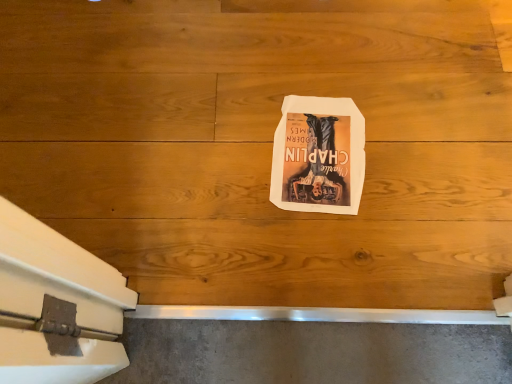
Describe the element at coordinates (318, 156) in the screenshot. This screenshot has width=512, height=384. I see `white paper at center` at that location.

This screenshot has width=512, height=384. What are the coordinates of `white paper at center` in the screenshot? It's located at (318, 156).

This screenshot has width=512, height=384. Find the location of `white paper at center`. white paper at center is located at coordinates (318, 156).